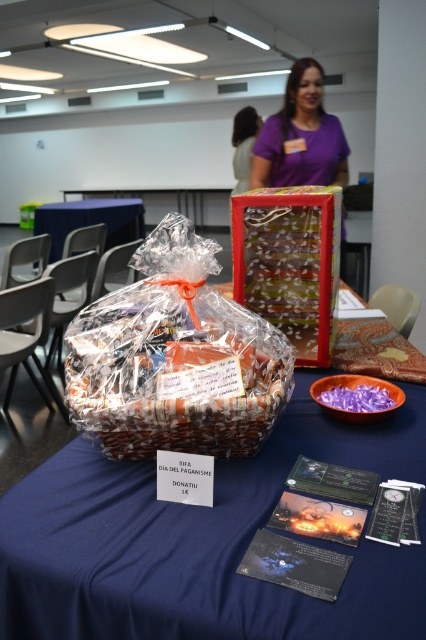
Is clear plastic bag at center further to camera compared to plastic wrapped basket at center?

Yes.

Who is more forward, [78,321] or [123,404]?

Point [123,404] is more forward.

In order to click on clear plastic bag at center in this screenshot , I will do `click(175, 358)`.

Between point (193, 550) and point (114, 198), which one is positioned behind?

Positioned behind is point (114, 198).

Is blue fabric tablecloth at center taller than blue fabric table at center?

Incorrect, blue fabric tablecloth at center's height is not larger of blue fabric table at center's.

Is point (43, 630) positioned after point (69, 220)?

That is False.

Image resolution: width=426 pixels, height=640 pixels. I want to click on blue fabric tablecloth at center, so click(203, 541).

From the picture: Between clear plastic bag at center and blue fabric table at center, which one has less height?

With less height is clear plastic bag at center.

Can you confirm if clear plastic bag at center is positioned to the right of blue fabric table at center?

Indeed, clear plastic bag at center is positioned on the right side of blue fabric table at center.

The image size is (426, 640). What do you see at coordinates (175, 358) in the screenshot?
I see `clear plastic bag at center` at bounding box center [175, 358].

The image size is (426, 640). I want to click on clear plastic bag at center, so click(x=175, y=358).